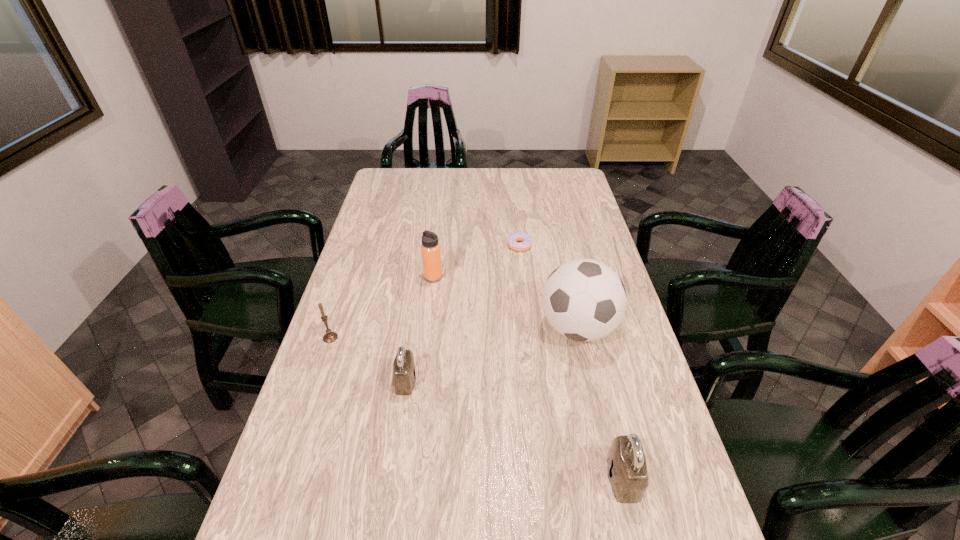
Find the location of a particular element. the left padlock is located at coordinates (404, 373).

The width and height of the screenshot is (960, 540). In order to click on the farther padlock in this screenshot , I will do `click(404, 373)`.

Locate an element on the screen. The image size is (960, 540). the taller padlock is located at coordinates (626, 462).

In order to click on the right padlock in this screenshot , I will do `click(626, 462)`.

This screenshot has width=960, height=540. I want to click on soccer ball, so click(x=584, y=300).

Locate an element on the screen. The image size is (960, 540). thermos bottle is located at coordinates (430, 248).

The width and height of the screenshot is (960, 540). In order to click on the fifth shortest object in this screenshot , I will do `click(430, 248)`.

Identify the location of doughnut. (526, 240).

This screenshot has width=960, height=540. Identify the location of the shortest object. (526, 240).

Where is `the leftmost object`? the leftmost object is located at coordinates (329, 337).